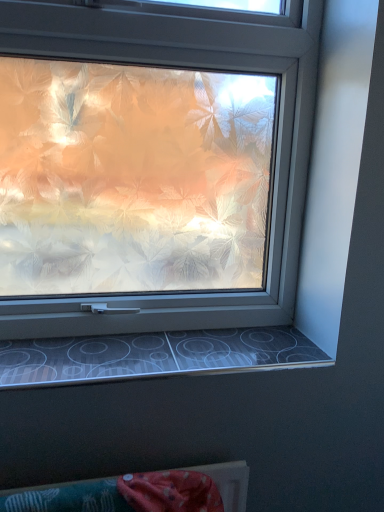
Identify the location of dark gray textured mat at bottom. (154, 355).

Measure the distance between point [160,354] and camera.

Point [160,354] and camera are 1.06 meters apart.

What do you see at coordinates (154, 355) in the screenshot? This screenshot has width=384, height=512. I see `dark gray textured mat at bottom` at bounding box center [154, 355].

This screenshot has height=512, width=384. In order to click on dark gray textured mat at bottom in this screenshot , I will do `click(154, 355)`.